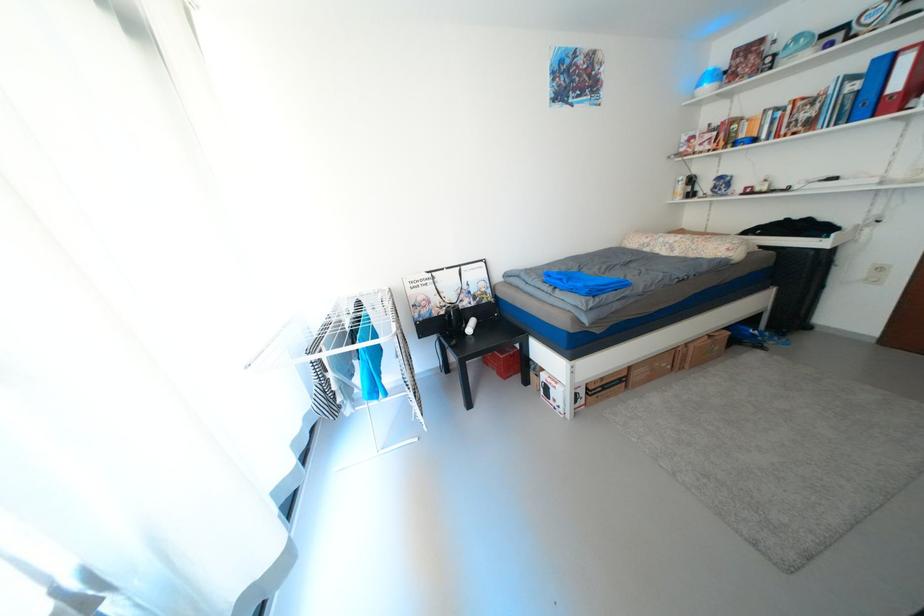
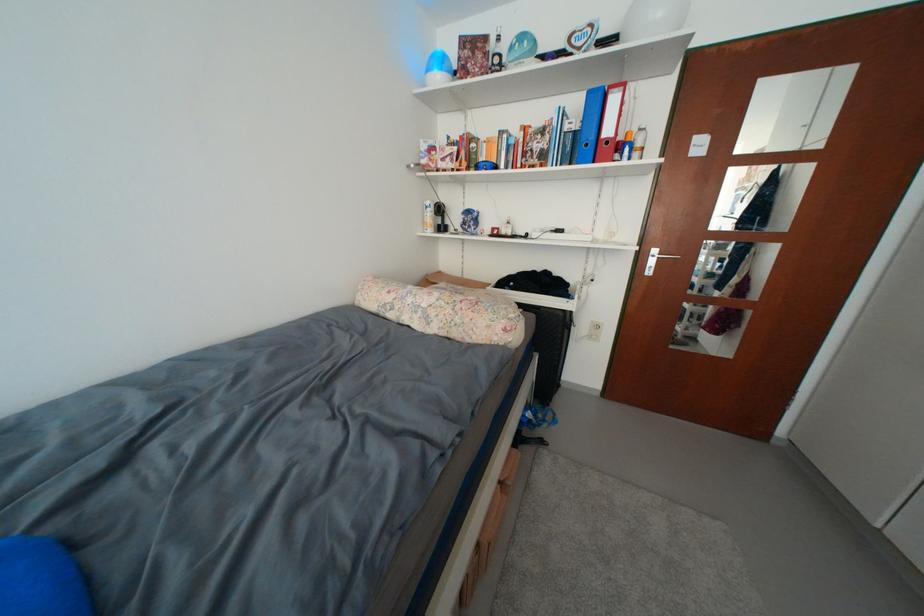
Where in the second image is the point corresponding to pixel 736 252 from the first image?

(514, 331)